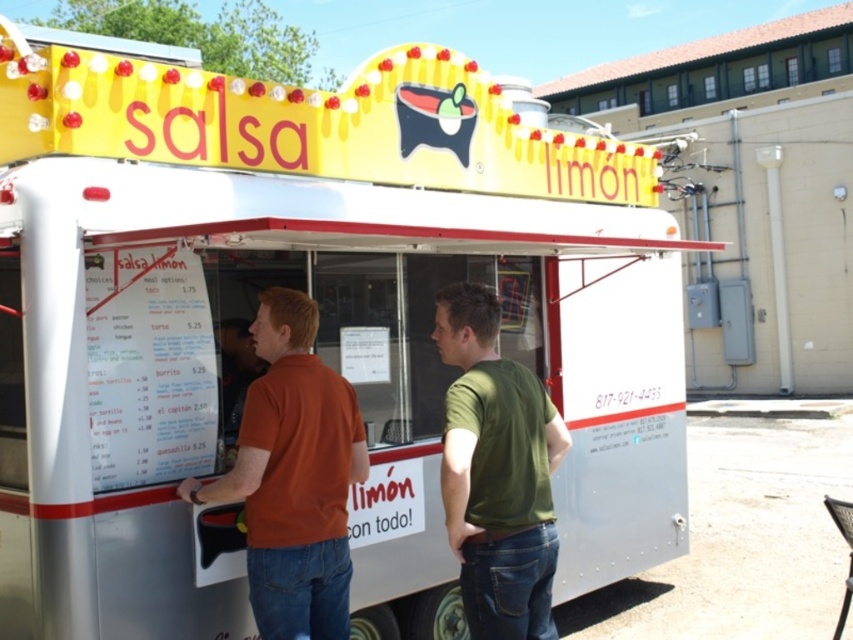
Looking at this image, measure the distance between point [299,582] and camera.

Point [299,582] is 10.21 feet from camera.

Is orange cotton shirt at center taller than green matte shirt at center?

Yes.

Which is behind, point (242, 438) or point (453, 349)?

Point (453, 349)

This screenshot has height=640, width=853. What are the coordinates of `orange cotton shirt at center` in the screenshot? It's located at (293, 476).